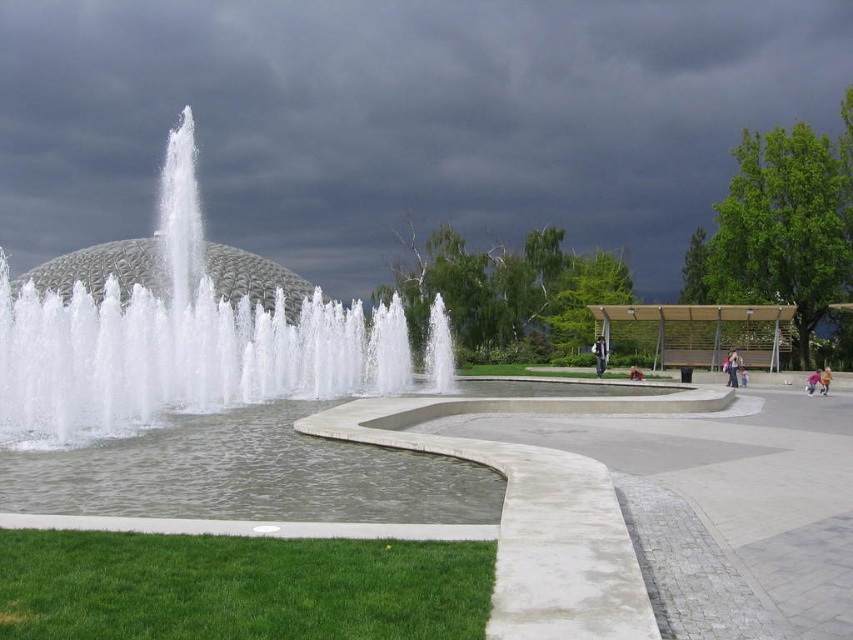
Question: Which of the following is the closest to the observer?

Choices:
 (A) brown leather jacket at center
 (B) light brown wooden bench at center right
 (C) pink fabric person at lower right

Answer: (C)

Question: Which of the following is the closest to the observer?

Choices:
 (A) light brown wooden bench at center right
 (B) light brown wooden bench at center

Answer: (A)

Question: Where is light brown wooden bench at center located in relation to pink fabric at lower right in the image?

Choices:
 (A) below
 (B) above

Answer: (B)

Question: Is dark gray cloud at upper center bigger than light brown wooden bench at center right?

Choices:
 (A) yes
 (B) no

Answer: (A)

Question: From the image, what is the correct spatial relationship of light brown wooden bench at center in relation to pink fabric person at lower right?

Choices:
 (A) below
 (B) above

Answer: (B)

Question: Which object is positioned farthest from the white water at center?

Choices:
 (A) pink fabric person at lower right
 (B) light brown wooden bench at center right

Answer: (A)